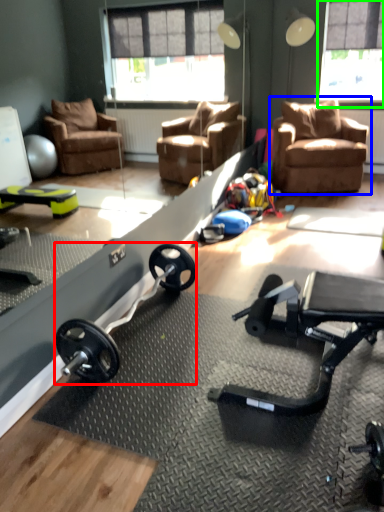
Question: Which is nearer to the barbell (highlighted by a red box)? chair (highlighted by a blue box) or window screen (highlighted by a green box).

Choices:
 (A) chair
 (B) window screen

Answer: (A)